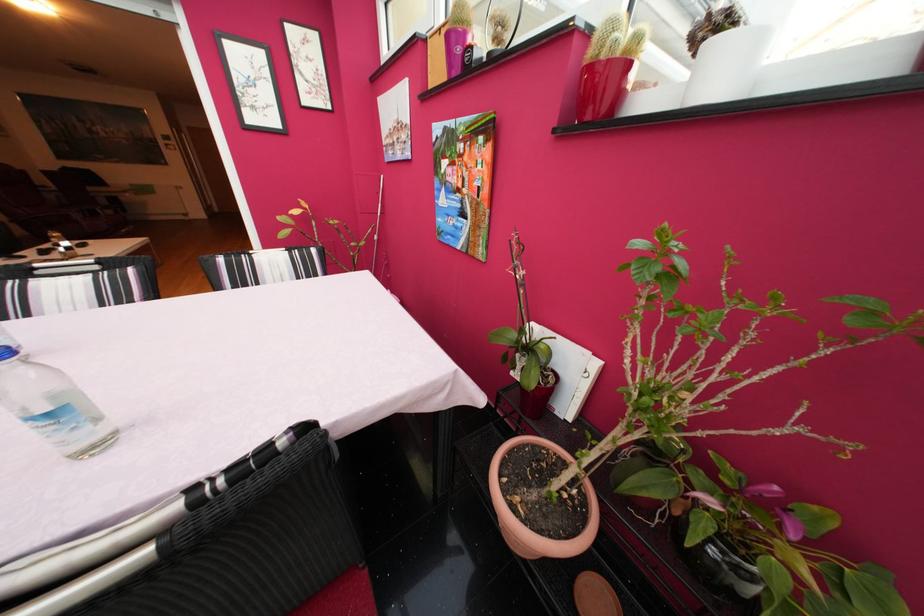
Where would you lift the white spiral notebook? Please return your answer as a coordinate pair (x, y).

(128, 538)